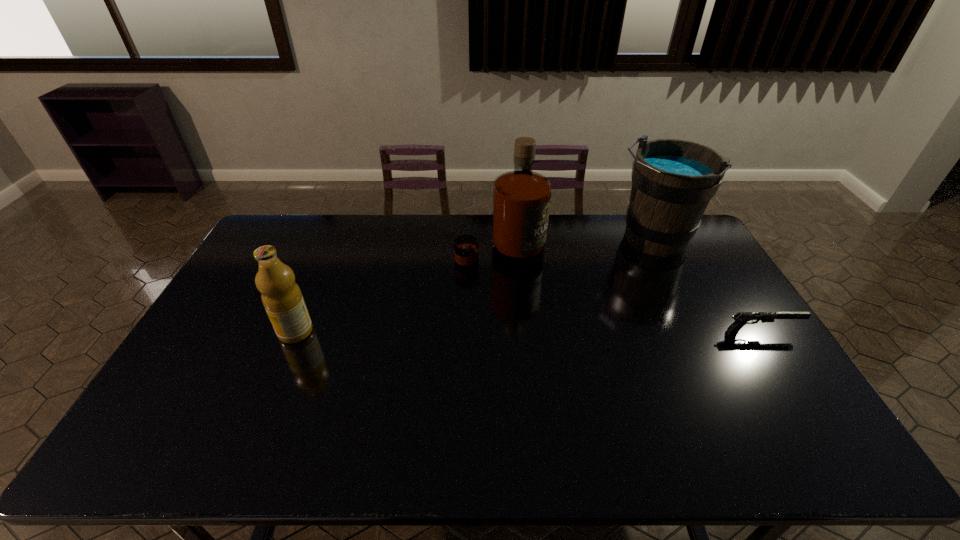
Where is `vacant space located with a handle on the side of the wine bucket`? This screenshot has width=960, height=540. vacant space located with a handle on the side of the wine bucket is located at coordinates (592, 310).

Where is `vacant space situated 0.210m with a handle on the side of the wine bucket`? vacant space situated 0.210m with a handle on the side of the wine bucket is located at coordinates (607, 293).

This screenshot has width=960, height=540. I want to click on liquor that is at the far edge, so click(x=521, y=198).

Locate an element on the screen. Image resolution: width=960 pixels, height=540 pixels. wine bucket present at the far edge is located at coordinates (673, 181).

Locate an element on the screen. The width and height of the screenshot is (960, 540). gun at the right edge is located at coordinates (741, 318).

Find the location of a particular element. This screenshot has width=960, height=540. wine bucket that is at the right edge is located at coordinates (673, 181).

In order to click on object that is at the far right corner in this screenshot , I will do `click(673, 181)`.

Where is `blank space at the far edge of the desktop`? blank space at the far edge of the desktop is located at coordinates pyautogui.click(x=347, y=214).

You are a GUI agent. You are given a task and a screenshot of the screen. Output one action in this format:
    pyautogui.click(x=<x>, y=<y>)
    Task: Click on the free space at the near edge of the desktop
    
    Given the screenshot: What is the action you would take?
    pyautogui.click(x=525, y=394)

Find the location of a particular element. free region at the left edge of the desktop is located at coordinates (229, 354).